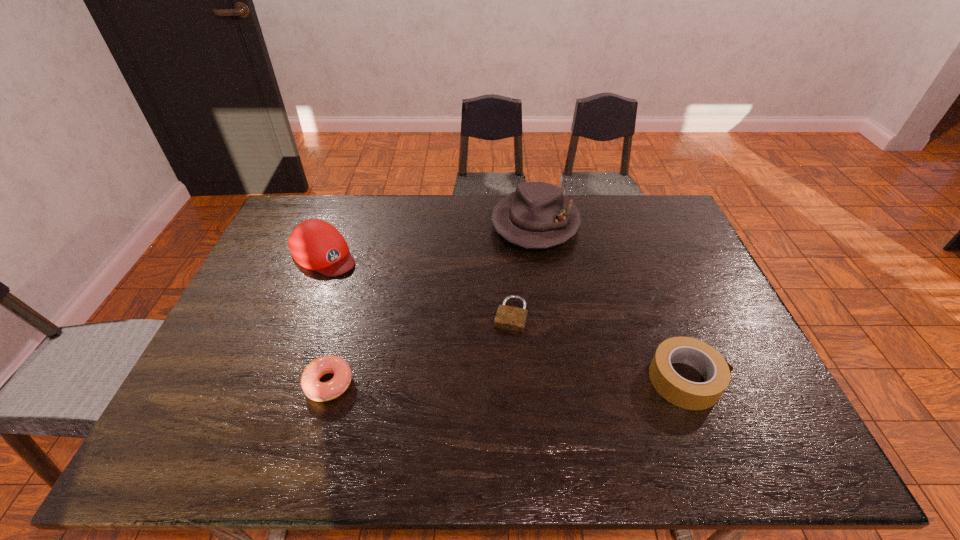
This screenshot has height=540, width=960. I want to click on free spot on the desktop that is between the doughnut and the duct tape and is positioned on the keyhole side of the shortest object, so click(x=492, y=382).

The width and height of the screenshot is (960, 540). What are the coordinates of `free space on the desktop that is between the doughnut and the rightmost object and is positioned on the decorative side of the tallest object` in the screenshot? It's located at pos(488,382).

Locate an element on the screen. This screenshot has width=960, height=540. free space on the desktop that is between the fourth tallest object and the rightmost object and is positioned on the front-facing side of the baseball cap is located at coordinates (478, 382).